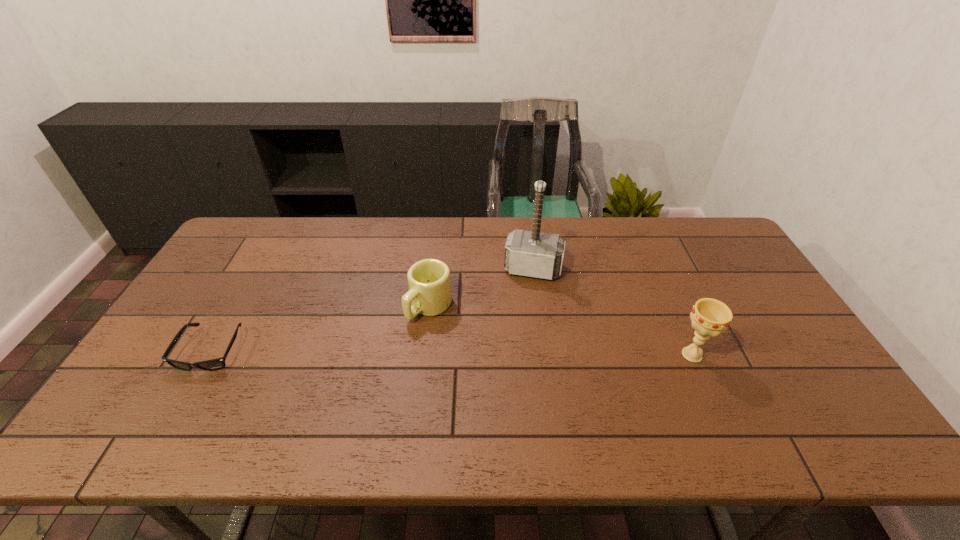
In order to click on free space on the desktop that is between the shortest object and the third shortest object and is positioned for striking with the head of the second object from right to left in this screenshot , I will do `click(516, 354)`.

Identify the location of vacant spot on the desktop that is between the shortest object and the rightmost object and is positioned with the handle on the side of the second object from left to right. (381, 352).